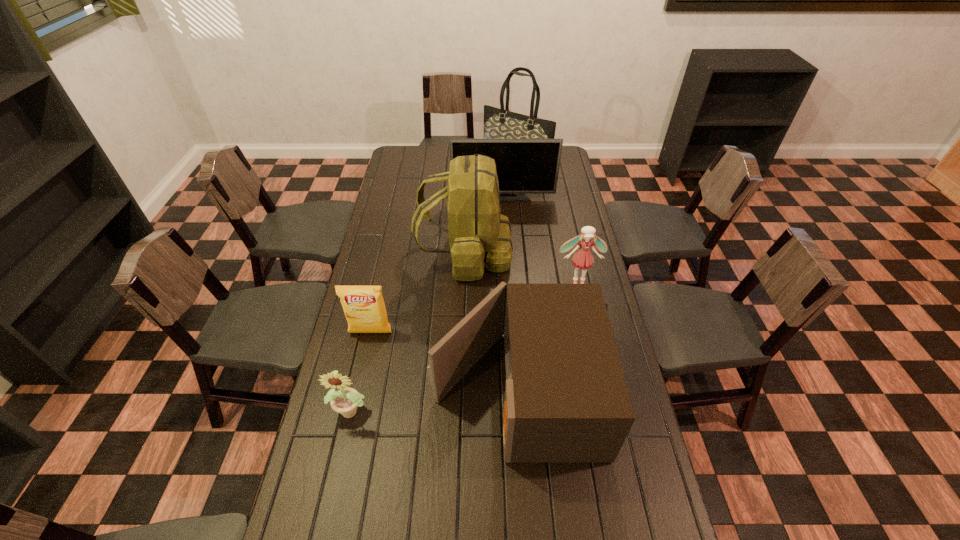
Locate an element on the screen. monitor that is positioned at the right edge is located at coordinates (524, 166).

Where is `doll located in the right edge section of the desktop`? doll located in the right edge section of the desktop is located at coordinates (583, 259).

Identify the location of microwave oven present at the right edge. The image size is (960, 540). (566, 400).

Where is `object that is at the far right corner`? object that is at the far right corner is located at coordinates (498, 123).

Where is `free space at the far edge`? Image resolution: width=960 pixels, height=540 pixels. free space at the far edge is located at coordinates pos(444,147).

In the image, there is a desktop. What are the coordinates of `vacant region at the left edge` in the screenshot? It's located at (x=378, y=362).

Locate an element on the screen. vacant space at the right edge is located at coordinates (661, 520).

Find the location of a particular element. Image resolution: width=960 pixels, height=540 pixels. blank space at the far left corner of the desktop is located at coordinates (398, 147).

Where is `empty space that is in between the doll and the farthest object`? The image size is (960, 540). empty space that is in between the doll and the farthest object is located at coordinates (547, 222).

At what (x,y) coordinates should I click in order to perform the action: click on vacant space in between the crisp (potato chip) and the sunflower. Please return your answer as a coordinate pair (x, y). The image size is (960, 540). Looking at the image, I should click on (362, 372).